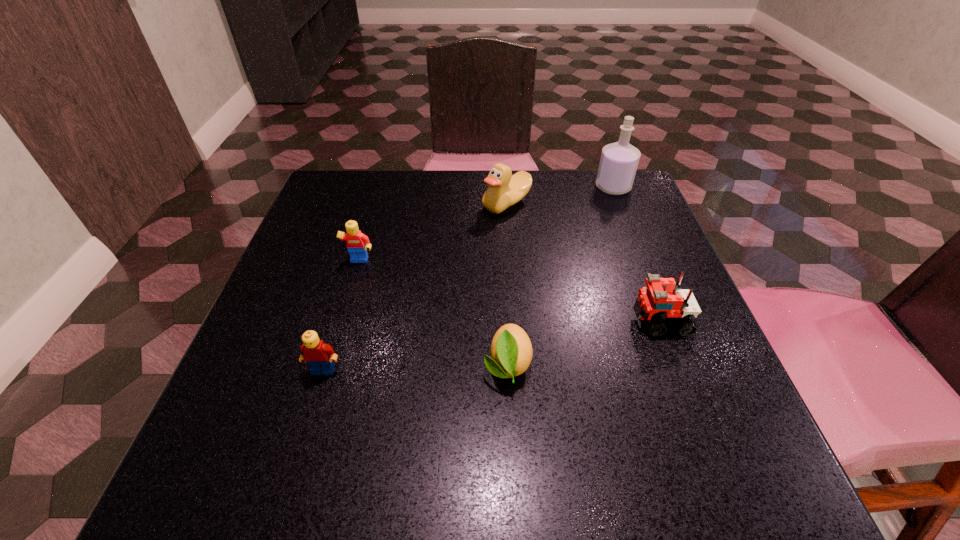
Where is `the tallest object`? the tallest object is located at coordinates (618, 164).

You are a GUI agent. You are given a task and a screenshot of the screen. Output one action in this format:
    pyautogui.click(x=<x>, y=<y>)
    Task: Click on the duck
    This screenshot has height=540, width=960.
    Given the screenshot: What is the action you would take?
    pyautogui.click(x=504, y=189)

At what (x,y) coordinates should I click in order to perform the action: click on the second farthest Lego. Please return your answer as a coordinate pair (x, y). Looking at the image, I should click on (656, 303).

The image size is (960, 540). I want to click on the rightmost Lego, so click(x=656, y=303).

This screenshot has height=540, width=960. In order to click on the farthest Lego in this screenshot , I will do [357, 243].

Locate an element on the screen. The height and width of the screenshot is (540, 960). the nearest Lego is located at coordinates (319, 356).

At what (x,y) coordinates should I click in order to perform the action: click on the shortest object. Please return your answer as a coordinate pair (x, y). The width and height of the screenshot is (960, 540). Looking at the image, I should click on (511, 351).

The height and width of the screenshot is (540, 960). In order to click on blank space located 0.110m on the front of the perfume in this screenshot , I will do `click(628, 224)`.

Image resolution: width=960 pixels, height=540 pixels. Identify the location of vacant area situated at the beak of the duck. (324, 204).

The width and height of the screenshot is (960, 540). I want to click on vacant space situated 0.200m at the beak of the duck, so click(400, 204).